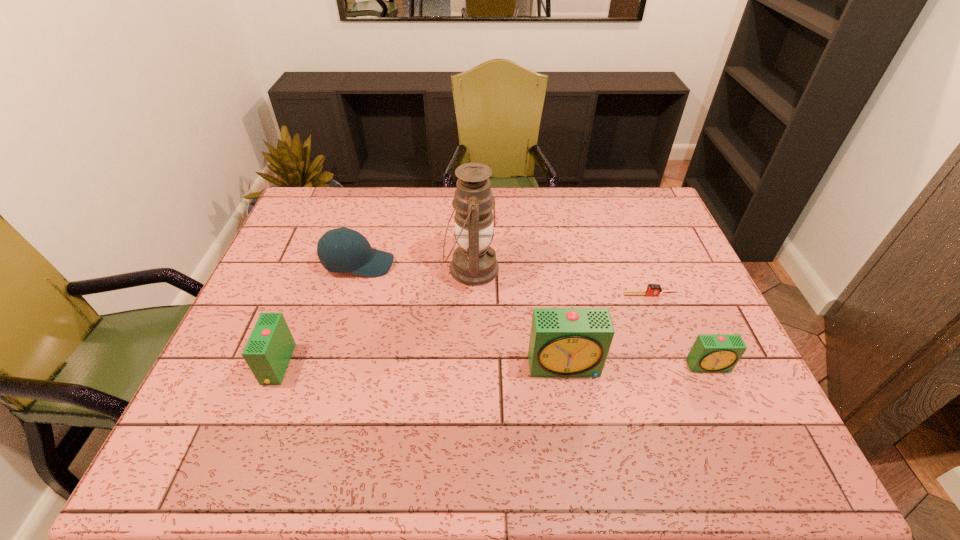
I want to click on vacant region that satisfies the following two spatial constraints: 1. on the back side of the fourth object from right to left; 2. on the front-facing side of the baseball cap, so click(x=471, y=264).

Identify the location of blank space that satisfies the following two spatial constraints: 1. on the front-facing side of the tape measure; 2. on the left side of the baseball cap. This screenshot has height=540, width=960. (349, 295).